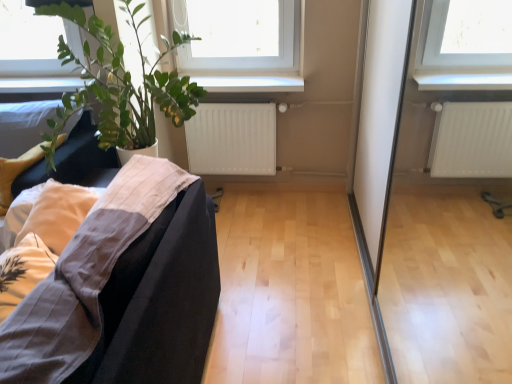
Question: Considering their positions, is green leafy plant at left located in front of or behind white matte radiator at center?

Choices:
 (A) front
 (B) behind

Answer: (A)

Question: Considering the positions of green leafy plant at left and white matte radiator at center in the image, is green leafy plant at left bigger or smaller than white matte radiator at center?

Choices:
 (A) big
 (B) small

Answer: (A)

Question: Which of these objects is positioned farthest from the white matte radiator at center?

Choices:
 (A) white glossy window sill at upper center
 (B) green leafy plant at left
 (C) transparent glass screen door at lower right
 (D) black fabric couch at lower left

Answer: (D)

Question: Which object is positioned farthest from the black fabric couch at lower left?

Choices:
 (A) white glossy window sill at upper center
 (B) green leafy plant at left
 (C) transparent glass screen door at lower right
 (D) white matte radiator at center

Answer: (A)